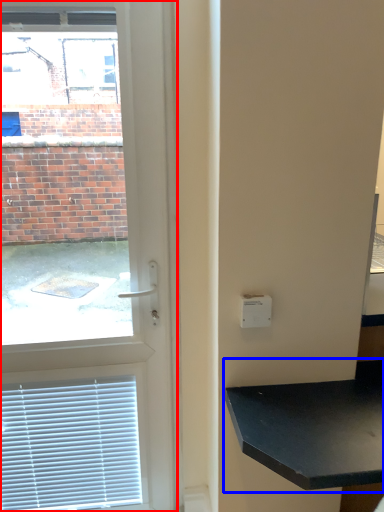
Question: Among these objects, which one is farthest to the camera, door (highlighted by a red box) or table (highlighted by a blue box)?

Choices:
 (A) door
 (B) table

Answer: (A)